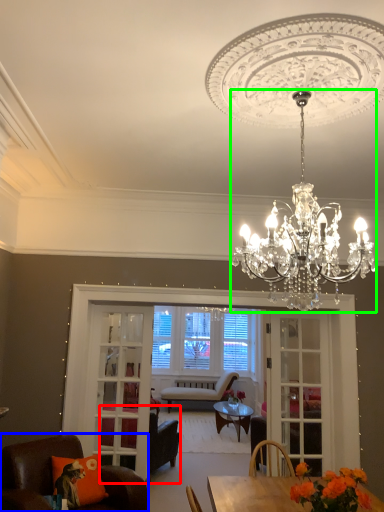
Question: Which object is the farthest from chair (highlighted by a red box)? Choose among these: chair (highlighted by a blue box) or chandelier (highlighted by a green box).

Choices:
 (A) chair
 (B) chandelier

Answer: (B)